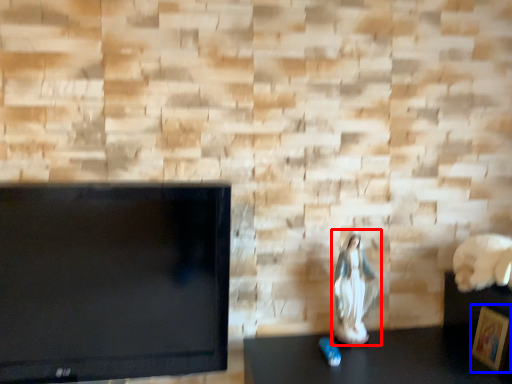
Question: Which point is closer to the camera, couple (highlighted by a red box) or picture frame (highlighted by a blue box)?

Choices:
 (A) couple
 (B) picture frame

Answer: (B)